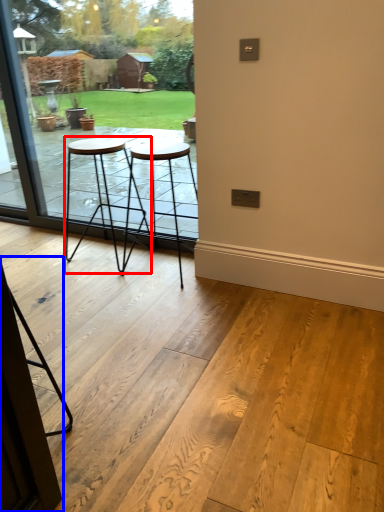
Question: Among these objects, which one is farthest to the camera, stool (highlighted by a red box) or screen door (highlighted by a blue box)?

Choices:
 (A) stool
 (B) screen door

Answer: (A)